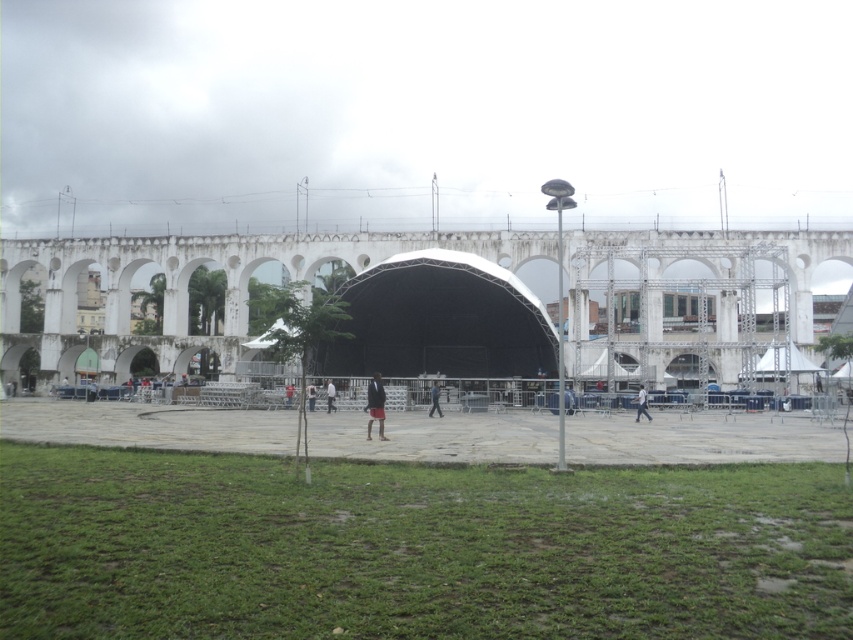
Can you confirm if black fabric amphitheater at center is shorter than dark blue jeans at center?

Incorrect, black fabric amphitheater at center's height does not fall short of dark blue jeans at center's.

Is point (523, 344) less distant than point (428, 412)?

No, it is behind (428, 412).

You are a GUI agent. You are given a task and a screenshot of the screen. Output one action in this format:
    pyautogui.click(x=<x>, y=<y>)
    Task: Click on the black fabric amphitheater at center
    This screenshot has height=640, width=853.
    Given the screenshot: What is the action you would take?
    pyautogui.click(x=444, y=300)

Can you confirm if white fabric person at center is taller than dark brown leather jacket at center?

Yes.

Can you confirm if white fabric person at center is positioned below dark brown leather jacket at center?

No, white fabric person at center is not below dark brown leather jacket at center.

Image resolution: width=853 pixels, height=640 pixels. What are the coordinates of `white fabric person at center` in the screenshot? It's located at (641, 403).

Between dark red fabric pants at center and dark blue jeans at center, which one has less height?

With less height is dark blue jeans at center.

Is dark red fabric pants at center to the right of dark blue jeans at center from the viewer's perspective?

In fact, dark red fabric pants at center is to the left of dark blue jeans at center.

Describe the element at coordinates (375, 404) in the screenshot. The height and width of the screenshot is (640, 853). I see `dark red fabric pants at center` at that location.

Where is `dark red fabric pants at center`? This screenshot has width=853, height=640. dark red fabric pants at center is located at coordinates (375, 404).